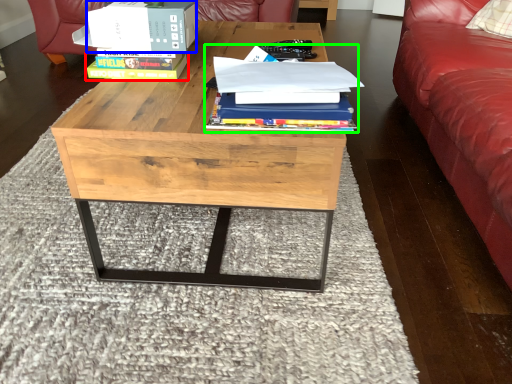
Question: Which is nearer to the paperback book (highlighted by a red box)? box (highlighted by a blue box) or book (highlighted by a green box).

Choices:
 (A) box
 (B) book

Answer: (A)